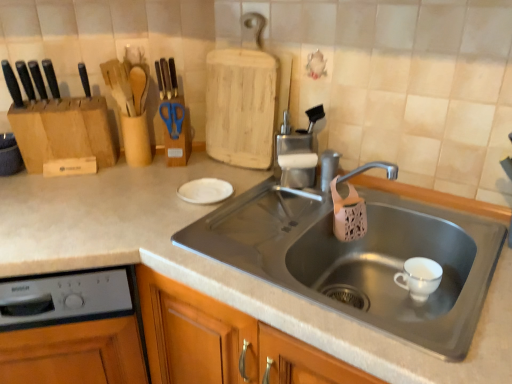
Question: Can you confirm if black matte knife at left, positioned as the third knife in right-to-left order, is bigger than blue plastic scissors at upper center?

Choices:
 (A) no
 (B) yes

Answer: (A)

Question: Does black matte knife at left, positioned as the third knife in right-to-left order, come behind blue plastic scissors at upper center?

Choices:
 (A) yes
 (B) no

Answer: (B)

Question: Can you confirm if black matte knife at left, positioned as the third knife in right-to-left order, is smaller than blue plastic scissors at upper center?

Choices:
 (A) no
 (B) yes

Answer: (B)

Question: From the image's perspective, is black matte knife at left, positioned as the third knife in right-to-left order, over blue plastic scissors at upper center?

Choices:
 (A) no
 (B) yes

Answer: (B)

Question: Could you tell me if black matte knife at left, the first knife positioned from the left, is turned towards blue plastic scissors at upper center?

Choices:
 (A) no
 (B) yes

Answer: (A)

Question: From the image's perspective, is gray plastic dishwasher at lower left positioned above or below blue plastic scissors at upper center?

Choices:
 (A) above
 (B) below

Answer: (B)

Question: Looking at their shapes, would you say gray plastic dishwasher at lower left is wider or thinner than blue plastic scissors at upper center?

Choices:
 (A) wide
 (B) thin

Answer: (A)

Question: Is gray plastic dishwasher at lower left situated inside blue plastic scissors at upper center or outside?

Choices:
 (A) outside
 (B) inside

Answer: (A)

Question: Visually, is gray plastic dishwasher at lower left positioned to the left or to the right of blue plastic scissors at upper center?

Choices:
 (A) left
 (B) right

Answer: (A)

Question: Considering the relative positions of black matte knife at left, which is the third knife from left to right, and blue plastic scissors at upper center in the image provided, is black matte knife at left, which is the third knife from left to right, to the left or to the right of blue plastic scissors at upper center?

Choices:
 (A) left
 (B) right

Answer: (A)

Question: Is black matte knife at left, positioned as the first knife in right-to-left order, wider or thinner than blue plastic scissors at upper center?

Choices:
 (A) thin
 (B) wide

Answer: (B)

Question: Considering the positions of point (39, 92) and point (170, 105), is point (39, 92) closer or farther from the camera than point (170, 105)?

Choices:
 (A) farther
 (B) closer

Answer: (B)

Question: From a real-world perspective, relative to blue plastic scissors at upper center, is black matte knife at left, which is the third knife from left to right, vertically above or below?

Choices:
 (A) below
 (B) above

Answer: (B)

Question: Looking at their shapes, would you say black matte knife at left, the first knife positioned from the left, is wider or thinner than black matte knife at left, which is the third knife from left to right?

Choices:
 (A) thin
 (B) wide

Answer: (A)

Question: Considering the relative positions of black matte knife at left, the first knife positioned from the left, and black matte knife at left, positioned as the first knife in right-to-left order, in the image provided, is black matte knife at left, the first knife positioned from the left, to the left or to the right of black matte knife at left, positioned as the first knife in right-to-left order,?

Choices:
 (A) left
 (B) right

Answer: (A)